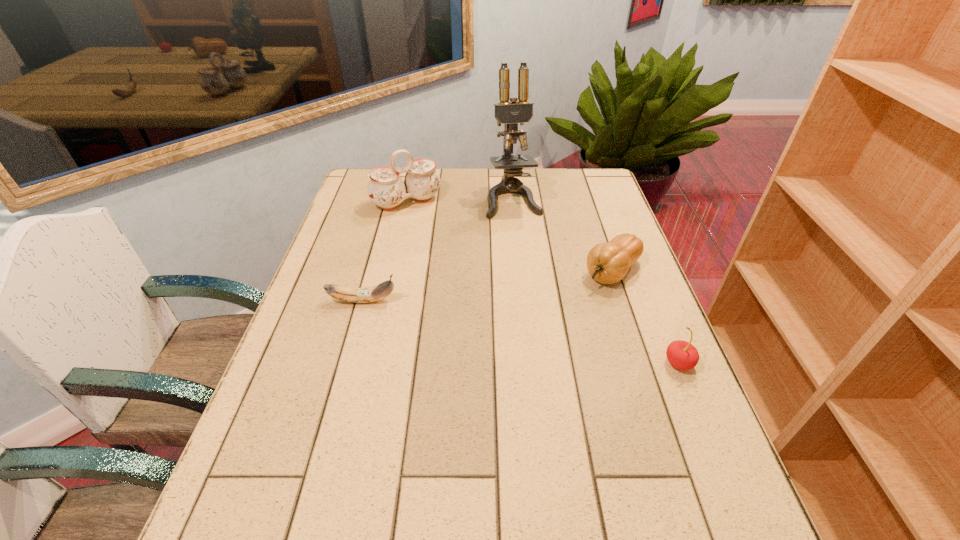
Find the location of `free area in between the fourth farthest object and the nearest object`. free area in between the fourth farthest object and the nearest object is located at coordinates tap(521, 332).

Identify the location of object that can be found as the second closest to the banana. (510, 113).

Identify the location of object that can be found as the closest to the gourd. Image resolution: width=960 pixels, height=540 pixels. point(510,113).

The width and height of the screenshot is (960, 540). Find the location of `vacant space that satisfies the following two spatial constraints: 1. on the front side of the third farthest object; 2. on the left side of the third object from left to right`. vacant space that satisfies the following two spatial constraints: 1. on the front side of the third farthest object; 2. on the left side of the third object from left to right is located at coordinates (520, 271).

Where is `free space that satisfies the following two spatial constraints: 1. on the front side of the cherry; 2. on the right side of the tallest object`? The image size is (960, 540). free space that satisfies the following two spatial constraints: 1. on the front side of the cherry; 2. on the right side of the tallest object is located at coordinates (530, 363).